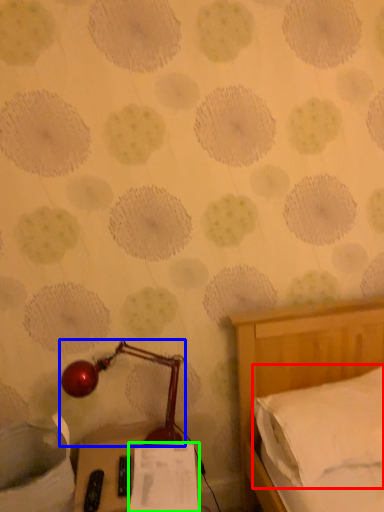
Question: Based on their relative distances, which object is farther from pillow (highlighted by a red box)? Choose from lamp (highlighted by a blue box) and paper (highlighted by a green box).

Choices:
 (A) lamp
 (B) paper

Answer: (A)